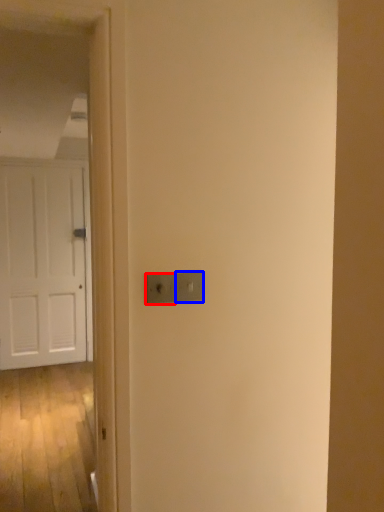
Question: Among these objects, which one is nearest to the camera, light switch (highlighted by a red box) or light switch (highlighted by a blue box)?

Choices:
 (A) light switch
 (B) light switch

Answer: (A)